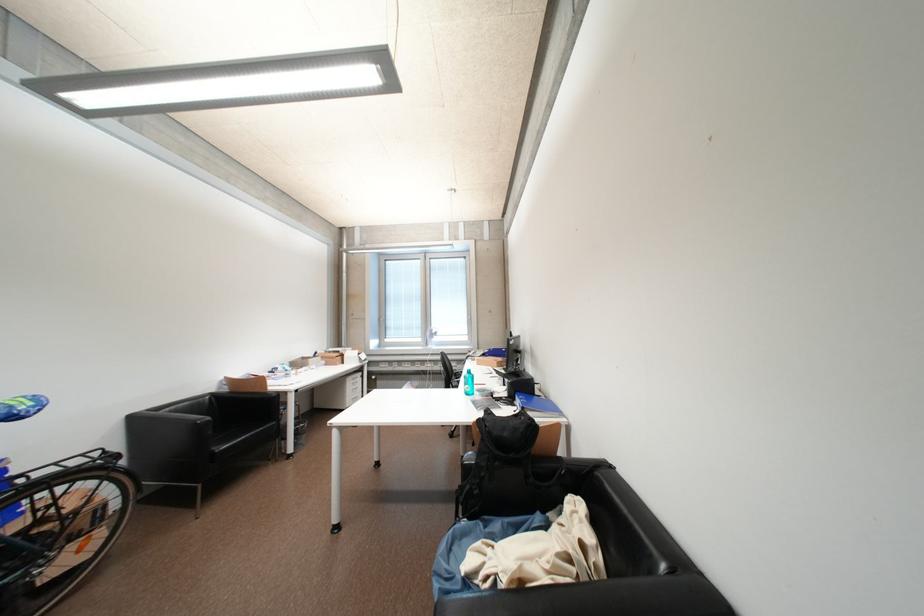
Where would you lift the black backpack handle? Please return your answer as a coordinate pair (x, y).

(497, 458)